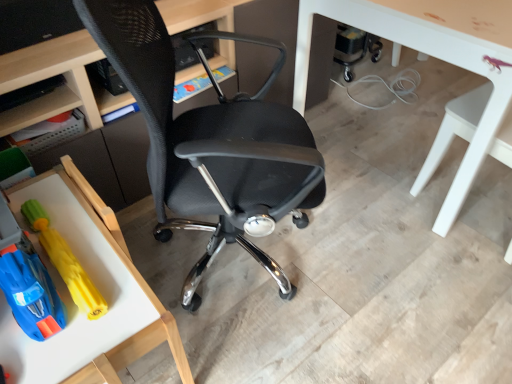
This screenshot has width=512, height=384. In order to click on free space in front of white glossy table at right, which ranks as the first chair in right-to-left order in this screenshot , I will do `click(467, 295)`.